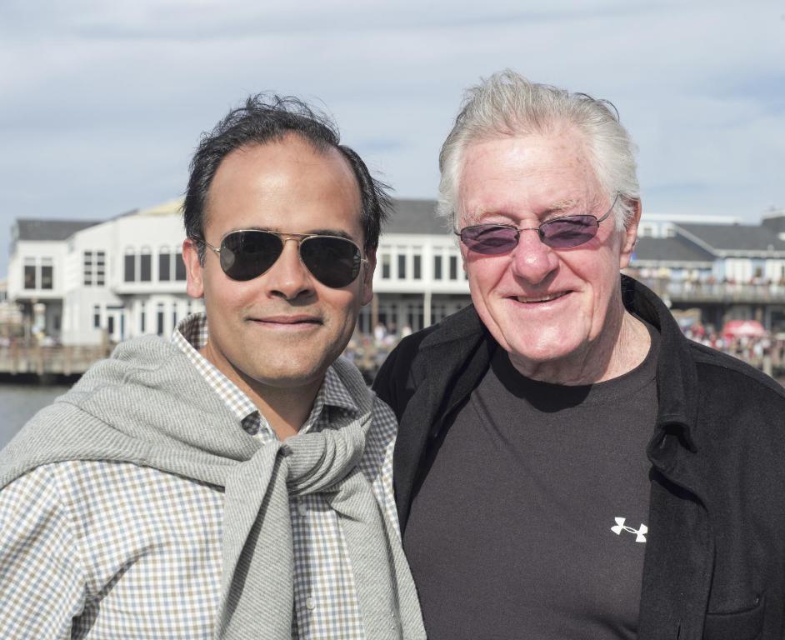
Question: Observing the image, what is the correct spatial positioning of matte black sunglasses at center in reference to sunglasses at center?

Choices:
 (A) below
 (B) above

Answer: (A)

Question: From the image, what is the correct spatial relationship of matte black sunglasses at center in relation to sunglasses at center?

Choices:
 (A) right
 (B) left

Answer: (B)

Question: Which point is closer to the camera taking this photo?

Choices:
 (A) (148, 584)
 (B) (477, 228)
 (C) (455, 476)

Answer: (A)

Question: Which point is closer to the camera taking this photo?

Choices:
 (A) (269, 525)
 (B) (9, 408)
 (C) (473, 230)

Answer: (A)

Question: Which object is positioned closest to the checkered fabric scarf at left?

Choices:
 (A) sunglasses at center
 (B) black matte jacket at center
 (C) matte black sunglasses at center

Answer: (C)

Question: Observing the image, what is the correct spatial positioning of checkered fabric scarf at left in reference to sunglasses at center?

Choices:
 (A) left
 (B) right

Answer: (A)